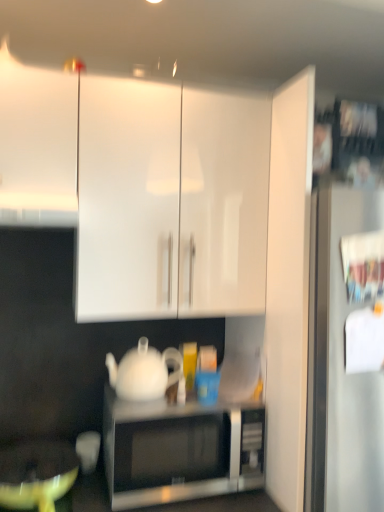
Locate an element on the screen. white glossy teapot at center is located at coordinates (144, 372).

Measure the distance between point [133,352] and camera.

5.18 feet.

Measure the distance between point (180, 479) and camera.

Point (180, 479) is 1.30 meters from camera.

This screenshot has width=384, height=512. I want to click on white glossy cabinet at upper left, the 1th cabinetry viewed from the left, so click(37, 145).

Which object is thinner, white glossy cabinet at upper center, which appears as the 1th cabinetry when viewed from the right, or sleek silver microwave at center?

Thinner between the two is sleek silver microwave at center.

Is sleek silver microwave at center a part of white glossy cabinet at upper center, the second cabinetry from the left?

No, sleek silver microwave at center is not inside white glossy cabinet at upper center, the second cabinetry from the left.

Considering the relative positions of white glossy cabinet at upper center, the second cabinetry from the left, and sleek silver microwave at center in the image provided, is white glossy cabinet at upper center, the second cabinetry from the left, to the right of sleek silver microwave at center from the viewer's perspective?

In fact, white glossy cabinet at upper center, the second cabinetry from the left, is to the left of sleek silver microwave at center.

You are a GUI agent. You are given a task and a screenshot of the screen. Output one action in this format:
    pyautogui.click(x=<x>, y=<y>)
    Task: Click on the teapot below the white glossy cabinet at upper center, the second cabinetry from the left (from a real-world perspective)
    
    Given the screenshot: What is the action you would take?
    pyautogui.click(x=144, y=372)

Consider the image. What's the angular difference between white glossy teapot at center and white glossy cabinet at upper center, which appears as the 1th cabinetry when viewed from the right,'s facing directions?

They differ by 1.11 degrees in their facing directions.

From the image's perspective, is white glossy teapot at center above or below white glossy cabinet at upper center, which appears as the 1th cabinetry when viewed from the right?

From the image's perspective, white glossy teapot at center appears below white glossy cabinet at upper center, which appears as the 1th cabinetry when viewed from the right.

Is white glossy teapot at center inside or outside of white glossy cabinet at upper center, which appears as the 1th cabinetry when viewed from the right?

The correct answer is: outside.

From a real-world perspective, is white glossy cabinet at upper left, the 1th cabinetry viewed from the left, located beneath white glossy cabinet at upper center, the second cabinetry from the left?

Actually, white glossy cabinet at upper left, the 1th cabinetry viewed from the left, is physically above white glossy cabinet at upper center, the second cabinetry from the left, in the real world.

In terms of height, does white glossy cabinet at upper left, which ranks as the 2th cabinetry in right-to-left order, look taller or shorter compared to white glossy cabinet at upper center, the second cabinetry from the left?

In the image, white glossy cabinet at upper left, which ranks as the 2th cabinetry in right-to-left order, appears to be shorter than white glossy cabinet at upper center, the second cabinetry from the left.

Which is correct: white glossy cabinet at upper left, the 1th cabinetry viewed from the left, is inside white glossy cabinet at upper center, the second cabinetry from the left, or outside of it?

white glossy cabinet at upper left, the 1th cabinetry viewed from the left, cannot be found inside white glossy cabinet at upper center, the second cabinetry from the left.

Locate an element on the screen. cabinetry behind the white glossy cabinet at upper left, the 1th cabinetry viewed from the left is located at coordinates (171, 201).

From the image's perspective, between white glossy cabinet at upper center, which appears as the 1th cabinetry when viewed from the right, and white glossy cabinet at upper left, which ranks as the 2th cabinetry in right-to-left order, which one is located above?

white glossy cabinet at upper left, which ranks as the 2th cabinetry in right-to-left order.

Considering the positions of objects white glossy cabinet at upper center, the second cabinetry from the left, and white glossy cabinet at upper left, which ranks as the 2th cabinetry in right-to-left order, in the image provided, who is behind, white glossy cabinet at upper center, the second cabinetry from the left, or white glossy cabinet at upper left, which ranks as the 2th cabinetry in right-to-left order,?

Positioned behind is white glossy cabinet at upper center, the second cabinetry from the left.

Considering the positions of objects white glossy cabinet at upper center, the second cabinetry from the left, and white glossy cabinet at upper left, the 1th cabinetry viewed from the left, in the image provided, who is more to the right, white glossy cabinet at upper center, the second cabinetry from the left, or white glossy cabinet at upper left, the 1th cabinetry viewed from the left,?

Positioned to the right is white glossy cabinet at upper center, the second cabinetry from the left.

From the image's perspective, is white glossy teapot at center over sleek silver microwave at center?

Indeed, from the image's perspective, white glossy teapot at center is shown above sleek silver microwave at center.

Which is in front, point (157, 384) or point (175, 445)?

The point (175, 445) is closer.

Would you consider white glossy teapot at center to be distant from sleek silver microwave at center?

They are positioned close to each other.

Is white glossy teapot at center wider or thinner than sleek silver microwave at center?

Considering their sizes, white glossy teapot at center looks slimmer than sleek silver microwave at center.

Is white glossy teapot at center in contact with matte yellow mixing bowl at lower left?

No, white glossy teapot at center is not with matte yellow mixing bowl at lower left.

Is white glossy teapot at center looking in the opposite direction of matte yellow mixing bowl at lower left?

No, white glossy teapot at center is not facing the opposite direction of matte yellow mixing bowl at lower left.

In the scene shown: Is white glossy teapot at center further to camera compared to matte yellow mixing bowl at lower left?

Yes, it is.

Is matte yellow mixing bowl at lower left completely or partially inside white glossy teapot at center?

Definitely not — matte yellow mixing bowl at lower left is not inside white glossy teapot at center.

This screenshot has height=512, width=384. Identify the location of mixing bowl below the white glossy cabinet at upper left, the 1th cabinetry viewed from the left (from the image's perspective). (36, 475).

From the image's perspective, is white glossy cabinet at upper left, the 1th cabinetry viewed from the left, beneath matte yellow mixing bowl at lower left?

Incorrect, from the image's perspective, white glossy cabinet at upper left, the 1th cabinetry viewed from the left, is higher than matte yellow mixing bowl at lower left.

Between white glossy cabinet at upper left, the 1th cabinetry viewed from the left, and matte yellow mixing bowl at lower left, which one has more height?

white glossy cabinet at upper left, the 1th cabinetry viewed from the left, is taller.

Is white glossy cabinet at upper left, which ranks as the 2th cabinetry in right-to-left order, positioned beyond the bounds of matte yellow mixing bowl at lower left?

Yes, white glossy cabinet at upper left, which ranks as the 2th cabinetry in right-to-left order, is located beyond the bounds of matte yellow mixing bowl at lower left.

This screenshot has width=384, height=512. I want to click on microwave oven located below the white glossy cabinet at upper center, which appears as the 1th cabinetry when viewed from the right (from the image's perspective), so click(179, 451).

There is a white glossy teapot at center. In order to click on the 1st cabinetry above it (from the image's perspective) in this screenshot , I will do `click(171, 201)`.

Which object lies nearer to the anchor point sleek silver microwave at center, white glossy cabinet at upper left, the 1th cabinetry viewed from the left, or white glossy teapot at center?

white glossy teapot at center lies closer to sleek silver microwave at center than the other object.

Considering their positions, is sleek silver microwave at center positioned further to matte yellow mixing bowl at lower left than white glossy teapot at center?

Among the two, white glossy teapot at center is located further to matte yellow mixing bowl at lower left.

From the image, which object appears to be farther from matte yellow mixing bowl at lower left, white glossy cabinet at upper center, which appears as the 1th cabinetry when viewed from the right, or sleek silver microwave at center?

white glossy cabinet at upper center, which appears as the 1th cabinetry when viewed from the right, is further to matte yellow mixing bowl at lower left.

Looking at the image, which one is located further to matte yellow mixing bowl at lower left, sleek silver microwave at center or white glossy cabinet at upper left, the 1th cabinetry viewed from the left?

The object further to matte yellow mixing bowl at lower left is white glossy cabinet at upper left, the 1th cabinetry viewed from the left.

From the image, which object appears to be farther from white glossy cabinet at upper center, which appears as the 1th cabinetry when viewed from the right, sleek silver microwave at center or matte yellow mixing bowl at lower left?

matte yellow mixing bowl at lower left lies further to white glossy cabinet at upper center, which appears as the 1th cabinetry when viewed from the right, than the other object.

Estimate the real-world distances between objects in this image. Which object is closer to white glossy teapot at center, sleek silver microwave at center or matte yellow mixing bowl at lower left?

The object closer to white glossy teapot at center is sleek silver microwave at center.

Which object lies further to the anchor point white glossy teapot at center, white glossy cabinet at upper center, which appears as the 1th cabinetry when viewed from the right, or white glossy cabinet at upper left, which ranks as the 2th cabinetry in right-to-left order?

white glossy cabinet at upper left, which ranks as the 2th cabinetry in right-to-left order.

Considering their positions, is matte yellow mixing bowl at lower left positioned closer to white glossy cabinet at upper center, the second cabinetry from the left, than white glossy cabinet at upper left, the 1th cabinetry viewed from the left?

white glossy cabinet at upper left, the 1th cabinetry viewed from the left.

This screenshot has height=512, width=384. What are the coordinates of `microwave oven between white glossy cabinet at upper left, which ranks as the 2th cabinetry in right-to-left order, and matte yellow mixing bowl at lower left, in the vertical direction` in the screenshot? It's located at (179, 451).

Locate an element on the screen. microwave oven between white glossy cabinet at upper center, the second cabinetry from the left, and matte yellow mixing bowl at lower left vertically is located at coordinates (179, 451).

Locate an element on the screen. teapot between white glossy cabinet at upper center, the second cabinetry from the left, and matte yellow mixing bowl at lower left in the up-down direction is located at coordinates (144, 372).

Where is `cabinetry that lies between white glossy cabinet at upper left, the 1th cabinetry viewed from the left, and matte yellow mixing bowl at lower left from top to bottom`? This screenshot has width=384, height=512. cabinetry that lies between white glossy cabinet at upper left, the 1th cabinetry viewed from the left, and matte yellow mixing bowl at lower left from top to bottom is located at coordinates (171, 201).